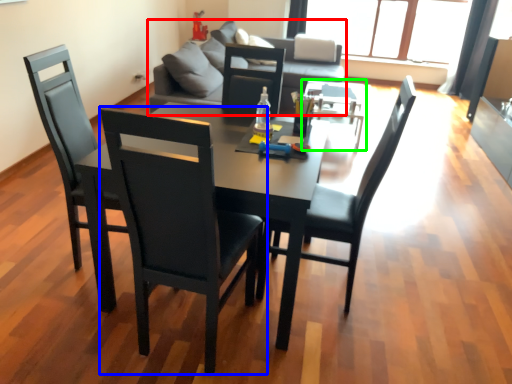
Question: Based on their relative distances, which object is nearer to studio couch (highlighted by a red box)? Choose from chair (highlighted by a blue box) and coffee table (highlighted by a green box).

Choices:
 (A) chair
 (B) coffee table

Answer: (B)